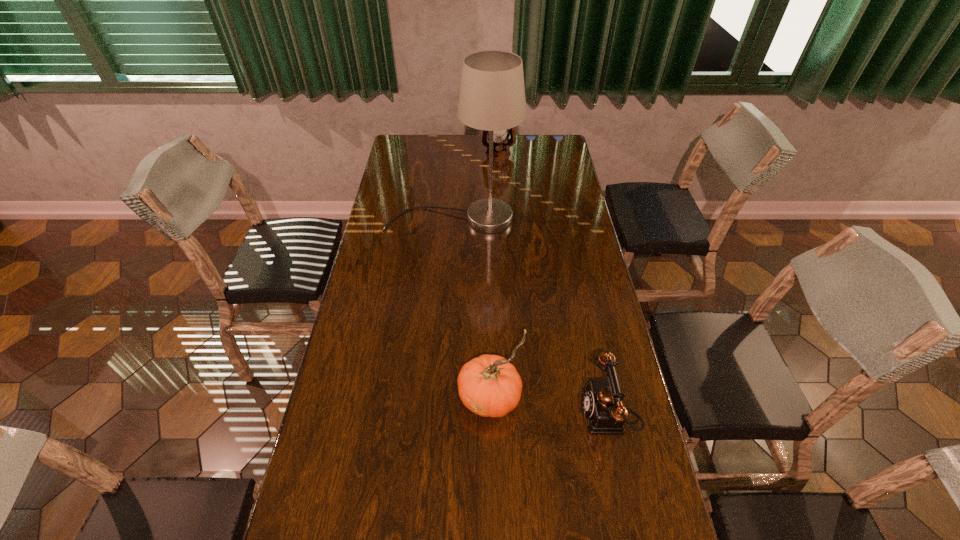
At what (x,y) coordinates should I click in order to perform the action: click on empty space between the table lamp and the telephone. Please return your answer as a coordinate pair (x, y). Looking at the image, I should click on (530, 316).

Locate an element on the screen. The height and width of the screenshot is (540, 960). free spot between the table lamp and the farthest object is located at coordinates (475, 186).

Where is `vacant area that lies between the shortest object and the pumpkin`? vacant area that lies between the shortest object and the pumpkin is located at coordinates (548, 406).

Identify the location of vacant area between the farthest object and the table lamp. The height and width of the screenshot is (540, 960). (475, 186).

Where is `unoccupied area between the tallest object and the pumpkin`? unoccupied area between the tallest object and the pumpkin is located at coordinates (471, 308).

The image size is (960, 540). What are the coordinates of `vacant space in between the farthest object and the third nearest object` in the screenshot? It's located at [475, 186].

The width and height of the screenshot is (960, 540). Find the location of `free space between the telephone and the second farthest object`. free space between the telephone and the second farthest object is located at coordinates (530, 316).

At what (x,y) coordinates should I click in order to perform the action: click on free spot between the telephone and the second farthest object. Please return your answer as a coordinate pair (x, y). Looking at the image, I should click on (530, 316).

Identify which object is the second closest to the second farthest object. Please provide its 2D coordinates. Your answer should be formatted as a tuple, i.e. [(x, y)], where the tuple contains the x and y coordinates of a point satisfying the conditions above.

[(488, 385)]

Image resolution: width=960 pixels, height=540 pixels. What are the coordinates of `object that stands as the second closest to the table lamp` in the screenshot? It's located at (488, 385).